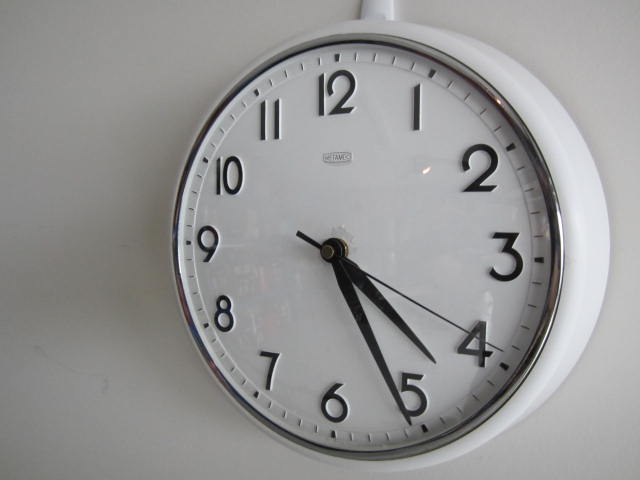
You are a GUI agent. You are given a task and a screenshot of the screen. Output one action in this format:
    pyautogui.click(x=<x>, y=<y>)
    Task: Click on the wall hanging piece
    The height and width of the screenshot is (480, 640).
    Given the screenshot: What is the action you would take?
    pyautogui.click(x=372, y=8)